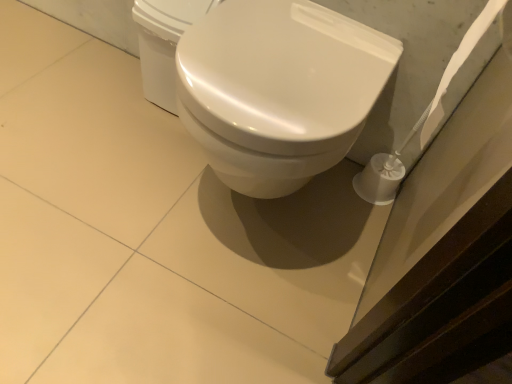
Question: Is white glossy toilet at upper center inside the boundaries of white glossy toilet at center, or outside?

Choices:
 (A) inside
 (B) outside

Answer: (B)

Question: From the image's perspective, is white glossy toilet at upper center located above or below white glossy toilet at center?

Choices:
 (A) above
 (B) below

Answer: (A)

Question: Considering the positions of white glossy toilet at upper center and white glossy toilet at center in the image, is white glossy toilet at upper center bigger or smaller than white glossy toilet at center?

Choices:
 (A) big
 (B) small

Answer: (B)

Question: From a real-world perspective, is white glossy toilet at center positioned above or below white glossy toilet at upper center?

Choices:
 (A) below
 (B) above

Answer: (B)

Question: Is point (204, 107) closer or farther from the camera than point (155, 28)?

Choices:
 (A) closer
 (B) farther

Answer: (A)

Question: Is white glossy toilet at center to the left or to the right of white glossy toilet at upper center in the image?

Choices:
 (A) left
 (B) right

Answer: (B)

Question: From the image's perspective, is white glossy toilet at center located above or below white glossy toilet at upper center?

Choices:
 (A) above
 (B) below

Answer: (B)